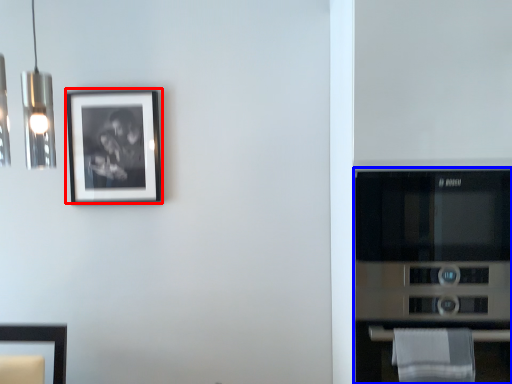
Question: Which object is closer to the camera taking this photo, picture frame (highlighted by a red box) or appliance (highlighted by a blue box)?

Choices:
 (A) picture frame
 (B) appliance

Answer: (B)